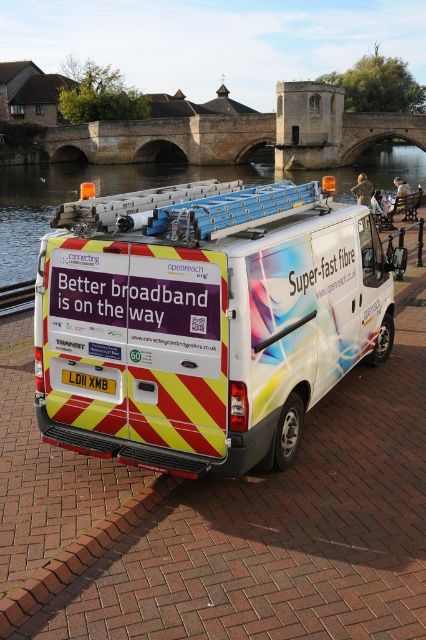
Question: Which point is closer to the camera?

Choices:
 (A) clear water at center
 (B) metallic rail at lower left
 (C) brown stone bridge at center

Answer: (B)

Question: Which point appears closest to the camera in this image?

Choices:
 (A) (302, 381)
 (B) (158, 483)

Answer: (B)

Question: Considering the relative positions of clear water at center and brown stone bridge at center in the image provided, where is clear water at center located with respect to brown stone bridge at center?

Choices:
 (A) below
 (B) above

Answer: (A)

Question: Does white glossy van at center come behind brick at lower left?

Choices:
 (A) yes
 (B) no

Answer: (A)

Question: Is clear water at center behind brown stone bridge at center?

Choices:
 (A) yes
 (B) no

Answer: (B)

Question: Among these points, which one is farthest from the camera?

Choices:
 (A) (106, 145)
 (B) (31, 579)
 (C) (362, 212)

Answer: (A)